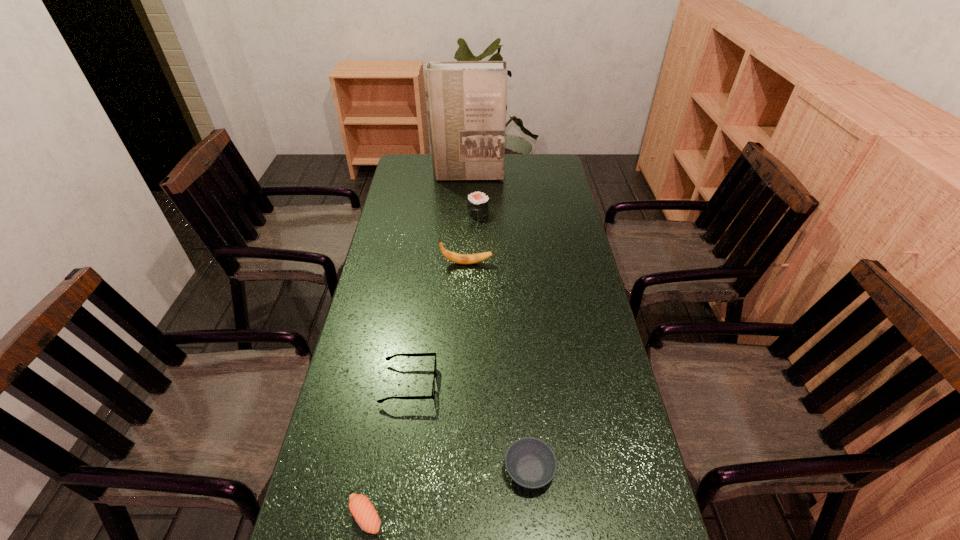
You are a GUI agent. You are given a task and a screenshot of the screen. Output one action in this format:
    pyautogui.click(x=<x>, y=<y>)
    Task: Click on the free area in between the left sushi and the soup bowl
    The width and height of the screenshot is (960, 540).
    Given the screenshot: What is the action you would take?
    pyautogui.click(x=447, y=493)

This screenshot has width=960, height=540. In order to click on free space between the shorter sushi and the fifth shortest object in this screenshot , I will do `click(417, 390)`.

Find the location of a particular element. The width and height of the screenshot is (960, 540). free area in between the left sushi and the right sushi is located at coordinates (x=421, y=364).

Identify which object is the second closest to the shorter sushi. Please provide its 2D coordinates. Your answer should be formatted as a tuple, i.e. [(x, y)], where the tuple contains the x and y coordinates of a point satisfying the conditions above.

[(531, 463)]

Select which object is the fifth closest to the spectacles. Please provide its 2D coordinates. Your answer should be formatted as a tuple, i.e. [(x, y)], where the tuple contains the x and y coordinates of a point satisfying the conditions above.

[(466, 100)]

Find the location of `free space that satisfies the following two spatial constraints: 1. on the peel of the third farthest object from the top; 2. on the back side of the fifth farthest object`. free space that satisfies the following two spatial constraints: 1. on the peel of the third farthest object from the top; 2. on the back side of the fifth farthest object is located at coordinates (460, 470).

The height and width of the screenshot is (540, 960). What are the coordinates of `vacant space that satisfies the following two spatial constraints: 1. on the cover of the farthest object; 2. on the right side of the farther sushi` in the screenshot? It's located at (467, 213).

Where is `free space that satisfies the following two spatial constraints: 1. on the peel of the third farthest object from the top; 2. on the left side of the second nearest object`? The width and height of the screenshot is (960, 540). free space that satisfies the following two spatial constraints: 1. on the peel of the third farthest object from the top; 2. on the left side of the second nearest object is located at coordinates (460, 470).

This screenshot has width=960, height=540. In order to click on vacant area in the image that satisfies the following two spatial constraints: 1. on the cover of the right sushi; 2. on the left side of the phonebook in this screenshot , I will do `click(467, 213)`.

This screenshot has height=540, width=960. I want to click on vacant space that satisfies the following two spatial constraints: 1. on the cover of the tallest object; 2. on the left side of the fifth farthest object, so click(457, 470).